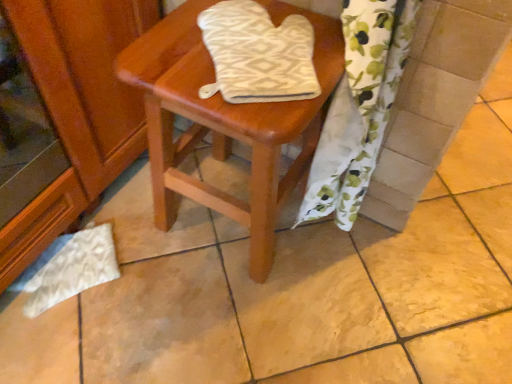
Where is `free location to the right of wooden stool at center`? Image resolution: width=512 pixels, height=384 pixels. free location to the right of wooden stool at center is located at coordinates (366, 278).